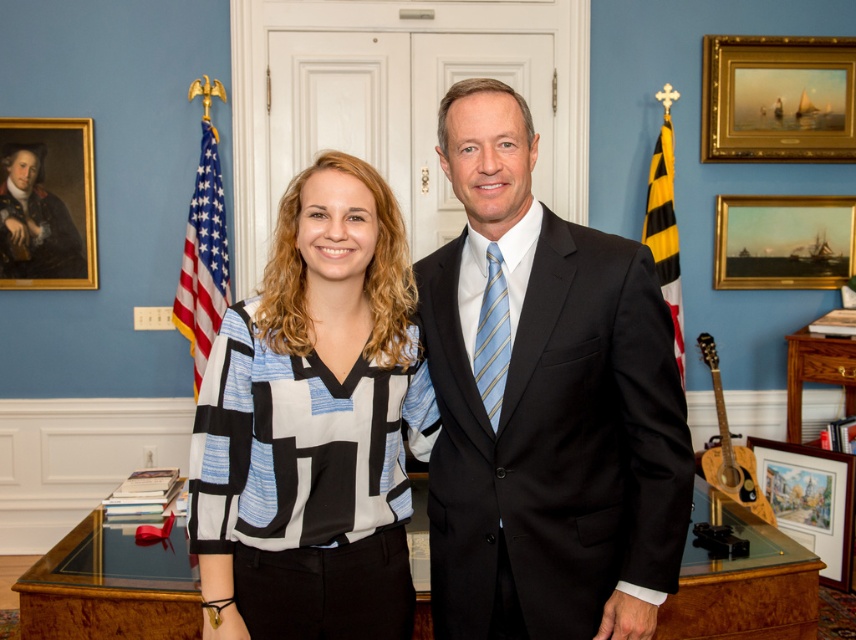
Question: Can you confirm if matte black suit at center is thinner than black wool suit at center?

Choices:
 (A) yes
 (B) no

Answer: (A)

Question: Is gold-framed painting at upper right to the right of yellow-black striped flag at right from the viewer's perspective?

Choices:
 (A) no
 (B) yes

Answer: (B)

Question: Which object appears closest to the camera in this image?

Choices:
 (A) matte wooden picture frame at lower right
 (B) yellow-black striped flag at right

Answer: (A)

Question: In this image, where is black wool suit at center located relative to matte black and white blouse at center?

Choices:
 (A) left
 (B) right

Answer: (B)

Question: Which point is closer to the camera?

Choices:
 (A) matte black suit at center
 (B) gold framed painting at upper right
 (C) matte wooden picture frame at lower right
 (D) gold-framed painting at upper right

Answer: (A)

Question: Which object appears farthest from the camera in this image?

Choices:
 (A) black wool suit at center
 (B) yellow-black striped flag at right
 (C) oil painting portrait at upper left

Answer: (C)